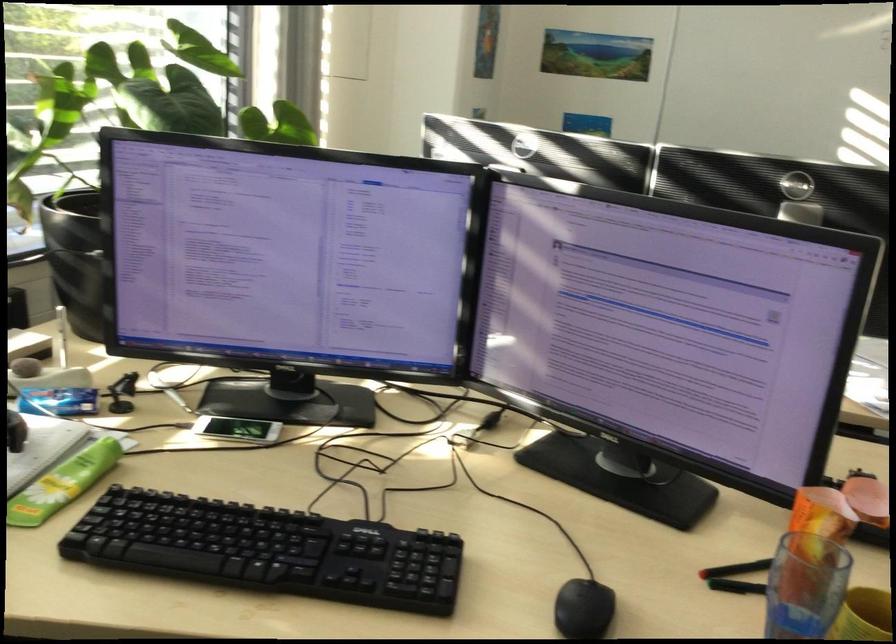
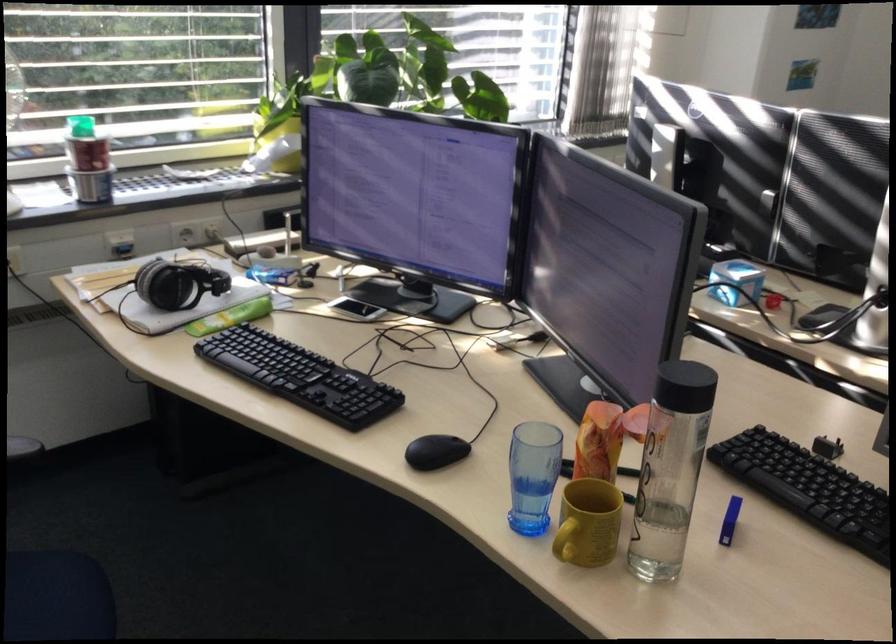
The point at [807,535] is marked in the first image. Where is the corresponding point in the second image?

(599, 442)